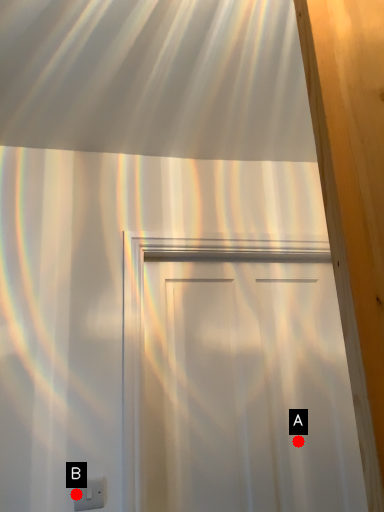
Question: Two points are circled on the image, labeled by A and B beside each circle. Among these points, which one is farthest from the camera?

Choices:
 (A) A is further
 (B) B is further

Answer: (A)